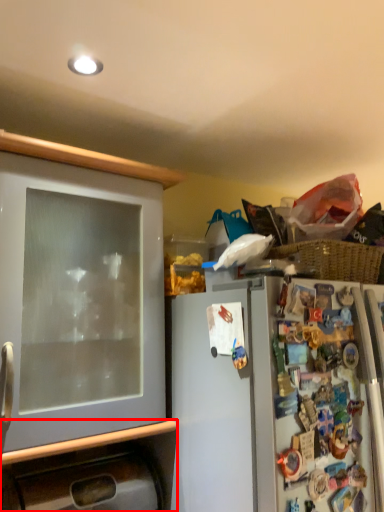
Question: From the image's perspective, where is cabinetry (annotated by the red box) located in relation to cabinetry in the image?

Choices:
 (A) below
 (B) above

Answer: (A)